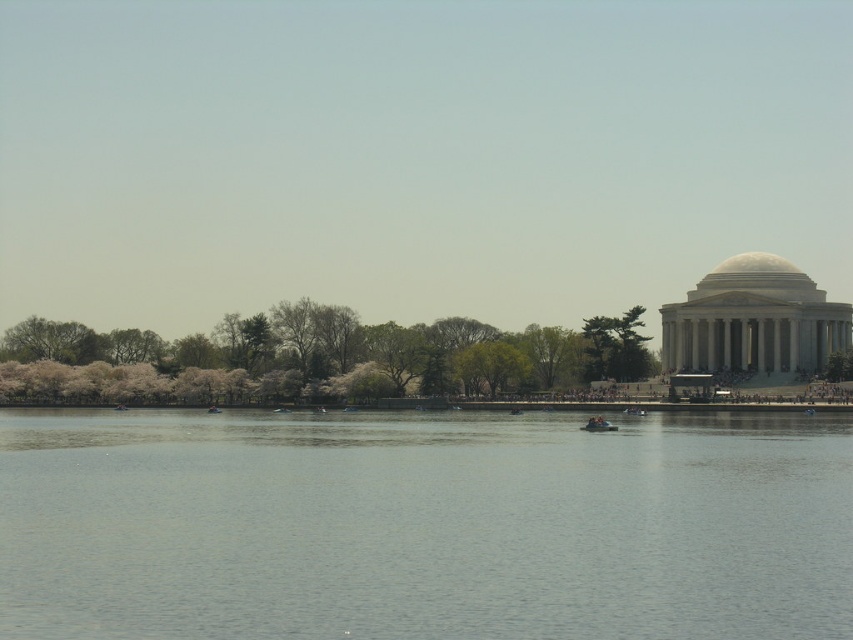
You are a photographer planning to capture a wide shot of the Jefferson Memorial and the surrounding area. You want to include both the gray water at center and the matte orange boat at center in your composition. Based on their relative positions and sizes, which object should you focus on first to ensure both are in frame?

The gray water at center is much taller than the matte orange boat at center, so you should focus on the gray water at center first to ensure both are in frame.

You are standing at the Jefferson Memorial and looking towards the gray water at center and the fluffy white blossoms at center. Which object is closer to you?

The gray water at center is closer to you since it is positioned in front of the fluffy white blossoms at center.

You are standing in front of the Jefferson Memorial and want to take a photo that includes both the point at coordinates point (389,564) and point (595,417). Which point should you focus on first to ensure both are in sharp focus?

You should focus on point (389,564) first because it is closer to you than point (595,417). This ensures that both points will be in focus as the closer point determines the depth of field.